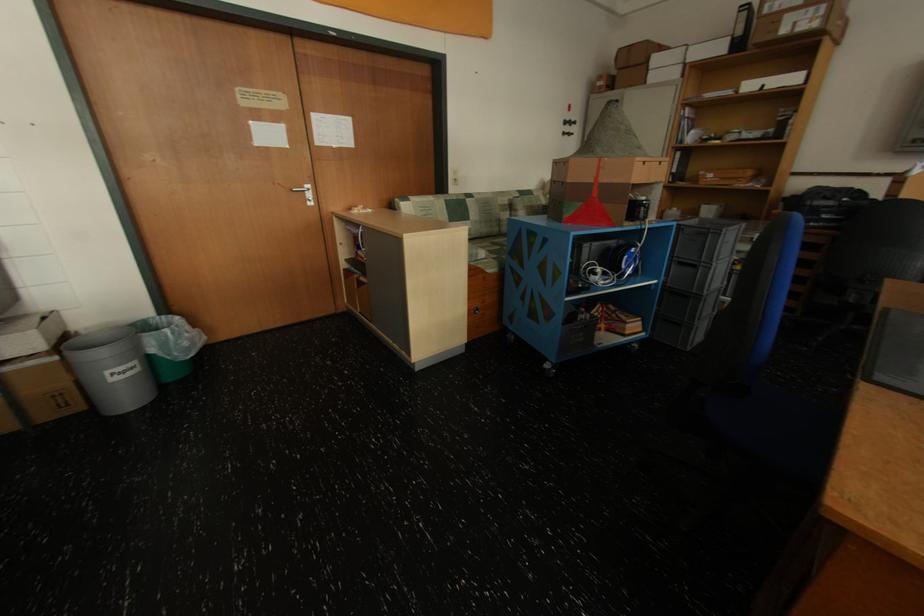
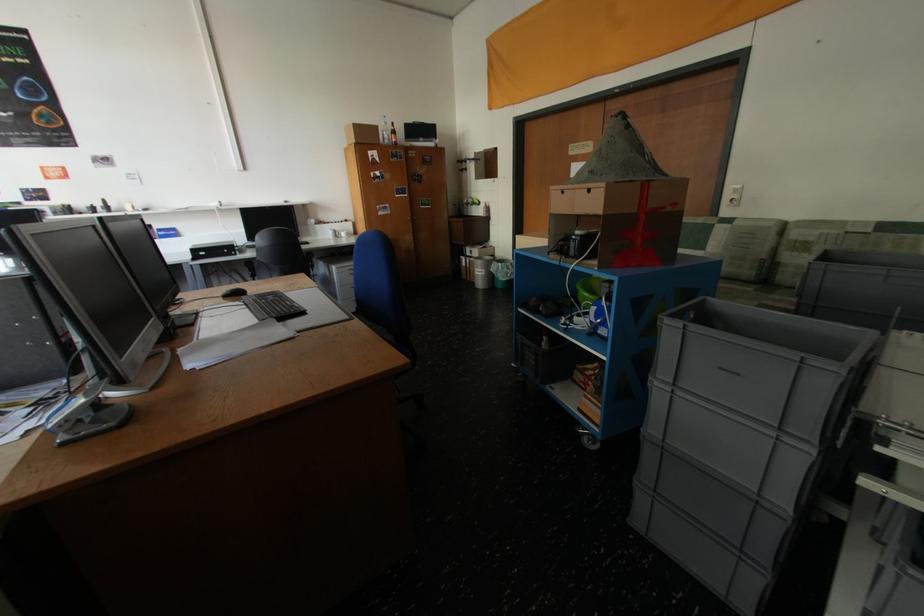
In the second image, find the point that corresponds to [116,374] in the first image.

(484, 270)